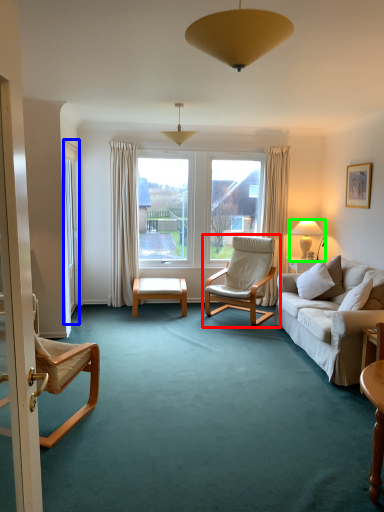
Question: Which object is the closest to the chair (highlighted by a red box)? Choose among these: screen door (highlighted by a blue box) or lamp (highlighted by a green box).

Choices:
 (A) screen door
 (B) lamp

Answer: (B)